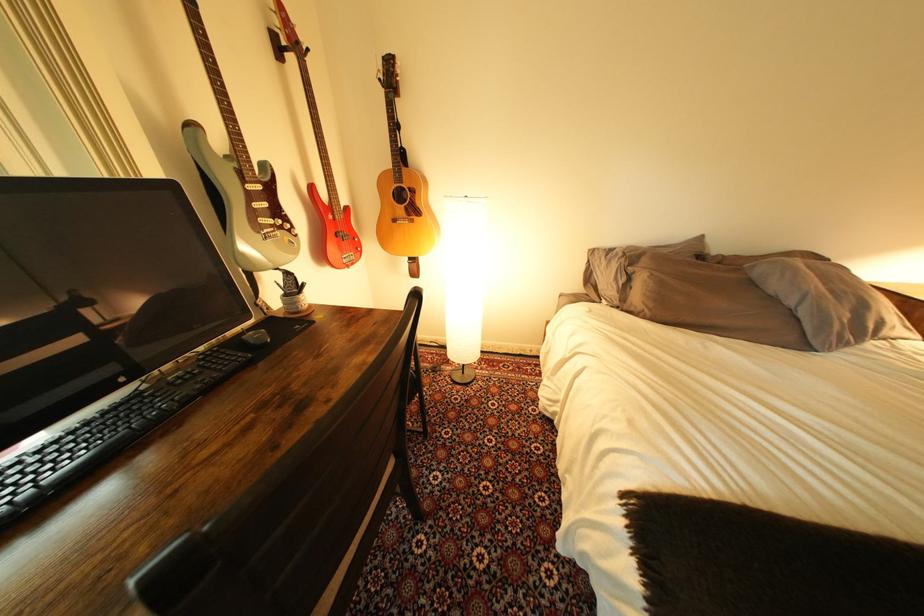
Describe the element at coordinates (256, 338) in the screenshot. I see `the black computer mouse` at that location.